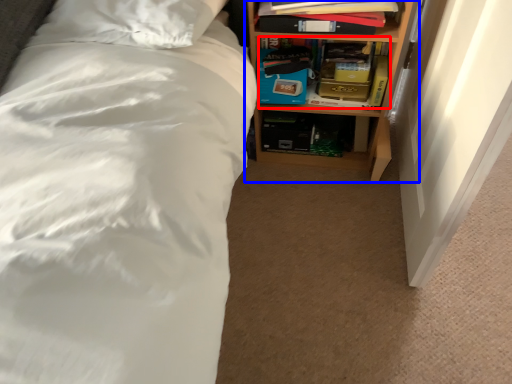
Question: Which point is further to the camera, book (highlighted by a red box) or shelf (highlighted by a blue box)?

Choices:
 (A) book
 (B) shelf

Answer: (A)